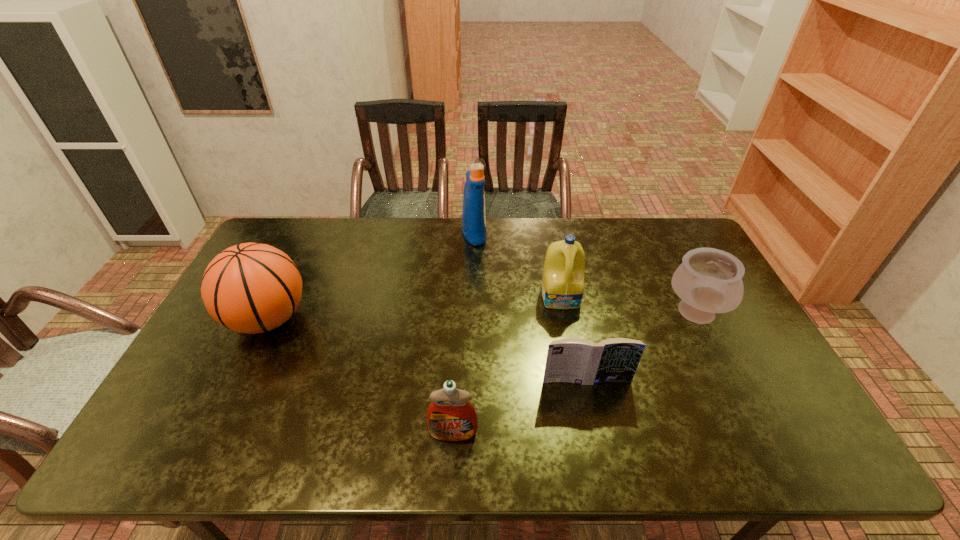
Find the location of a particular element. This screenshot has width=960, height=540. vacant space at the far left corner of the desktop is located at coordinates (271, 227).

I want to click on free spot at the far right corner of the desktop, so click(688, 230).

The height and width of the screenshot is (540, 960). Find the location of `free region at the near right corner`. free region at the near right corner is located at coordinates (787, 456).

Where is `unoccupied area between the rightmost detergent and the leftmost object`? Image resolution: width=960 pixels, height=540 pixels. unoccupied area between the rightmost detergent and the leftmost object is located at coordinates (415, 308).

Where is `free spot between the rightmost detergent and the nearest object`? This screenshot has height=540, width=960. free spot between the rightmost detergent and the nearest object is located at coordinates (507, 365).

Where is `vacant space that's between the tallest object and the book`? The height and width of the screenshot is (540, 960). vacant space that's between the tallest object and the book is located at coordinates (530, 307).

Find the location of a particular element. vacant space that's between the shortest object and the leftmost object is located at coordinates (427, 350).

Find the location of `free space that is in between the farthest object and the book`. free space that is in between the farthest object and the book is located at coordinates (530, 307).

You are a GUI agent. You are given a task and a screenshot of the screen. Output one action in this format:
    pyautogui.click(x=<x>, y=<y>)
    Task: Click on the vacant area that lies between the second farthest detergent and the tallest object
    This screenshot has height=540, width=960.
    Given the screenshot: What is the action you would take?
    pyautogui.click(x=517, y=265)

I want to click on vacant space that's between the second nearest detergent and the tallest object, so click(x=517, y=265).